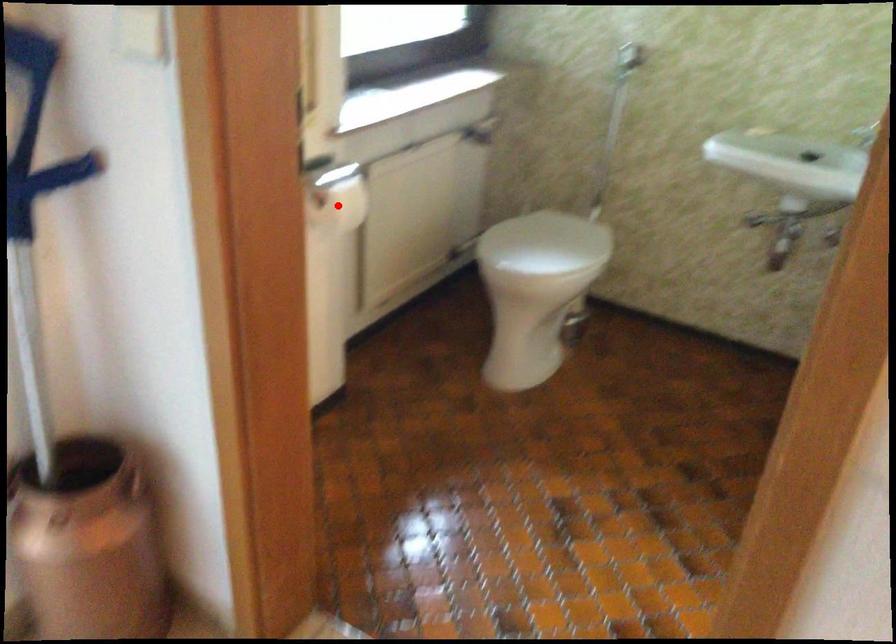
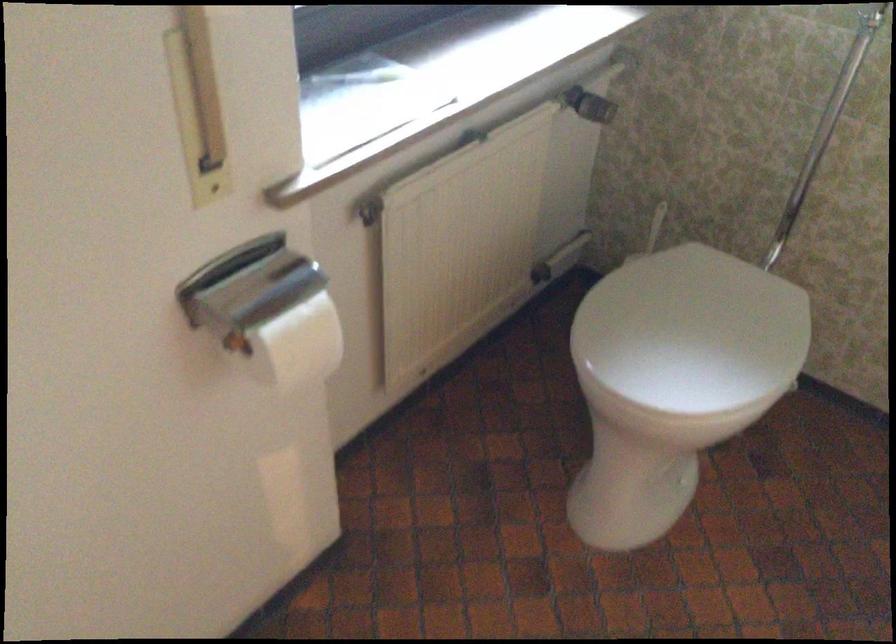
Where in the second image is the point corresponding to the highlighted location from the first image?

(298, 345)